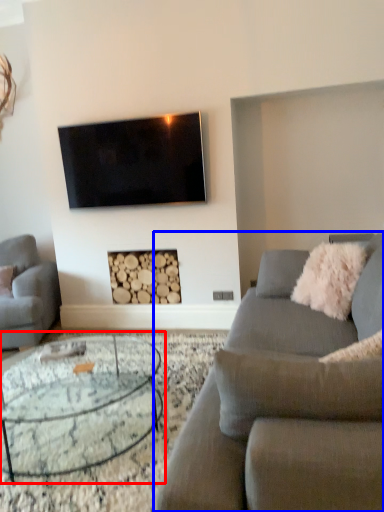
Question: Among these objects, which one is nearest to the camera, coffee table (highlighted by a red box) or studio couch (highlighted by a blue box)?

Choices:
 (A) coffee table
 (B) studio couch

Answer: (B)